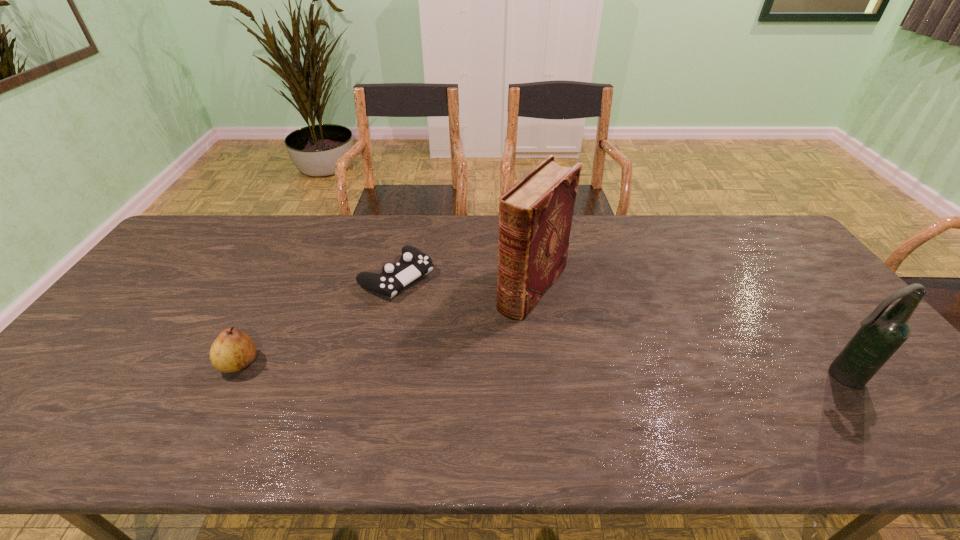
At what (x,y) coordinates should I click in order to perform the action: click on pear. Please return your answer as a coordinate pair (x, y). Looking at the image, I should click on (232, 351).

You are a GUI agent. You are given a task and a screenshot of the screen. Output one action in this format:
    pyautogui.click(x=<x>, y=<y>)
    Task: Click on the second shortest object
    
    Given the screenshot: What is the action you would take?
    pyautogui.click(x=232, y=351)

At what (x,y) coordinates should I click in order to perform the action: click on beer bottle. Please return your answer as a coordinate pair (x, y). Looking at the image, I should click on (882, 333).

You are a GUI agent. You are given a task and a screenshot of the screen. Output one action in this format:
    pyautogui.click(x=<x>, y=<y>)
    Task: Click on the second tallest object
    Image resolution: width=960 pixels, height=540 pixels.
    Given the screenshot: What is the action you would take?
    pyautogui.click(x=882, y=333)

Locate an element on the screen. This screenshot has height=540, width=960. the shortest object is located at coordinates (413, 263).

Where is `the second object from left to right`? The image size is (960, 540). the second object from left to right is located at coordinates (413, 263).

You are a GUI agent. You are given a task and a screenshot of the screen. Output one action in this format:
    pyautogui.click(x=<x>, y=<y>)
    Task: Click on the tallest object
    
    Given the screenshot: What is the action you would take?
    pyautogui.click(x=535, y=215)

At what (x,y) coordinates should I click in order to perform the action: click on hardback book. Please return your answer as a coordinate pair (x, y). The image size is (960, 540). Looking at the image, I should click on (535, 215).

Identify the location of vacant area located 0.280m on the left of the pear. The image size is (960, 540). click(x=108, y=363).

The width and height of the screenshot is (960, 540). Identify the location of vacant region located on the left of the second tallest object. (670, 376).